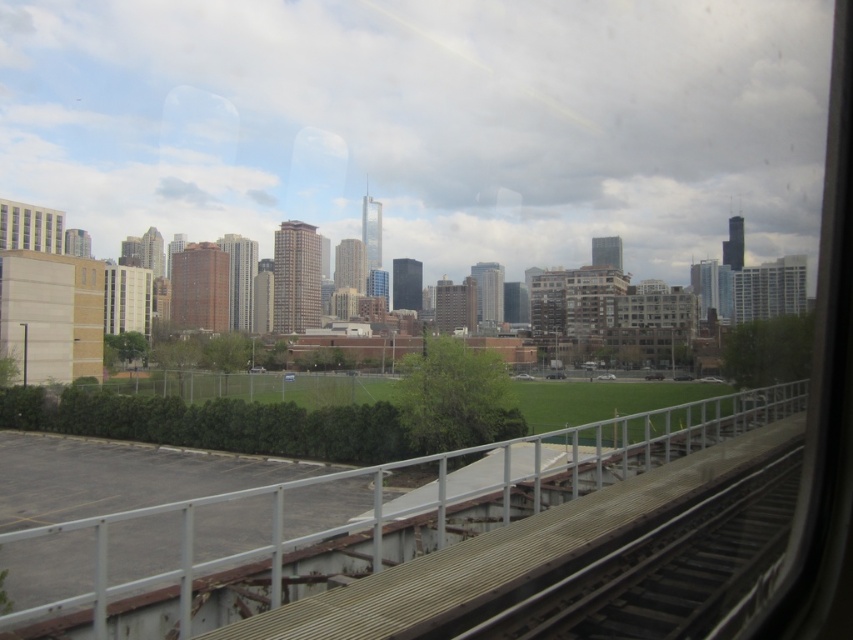
Question: Is metal/weathered rail at center bigger than matte glass building at left?

Choices:
 (A) no
 (B) yes

Answer: (B)

Question: Which object appears closest to the camera in this image?

Choices:
 (A) smooth metal train track at lower right
 (B) matte glass building at left
 (C) metal/weathered rail at center

Answer: (C)

Question: Which point is farther to the camera?

Choices:
 (A) smooth metal train track at lower right
 (B) matte glass building at left

Answer: (B)

Question: Is metal/weathered rail at center in front of smooth metal train track at lower right?

Choices:
 (A) yes
 (B) no

Answer: (A)

Question: Which point appears farthest from the camera in this image?

Choices:
 (A) (283, 492)
 (B) (55, 209)

Answer: (B)

Question: Observing the image, what is the correct spatial positioning of metal/weathered rail at center in reference to matte glass building at left?

Choices:
 (A) left
 (B) right

Answer: (B)